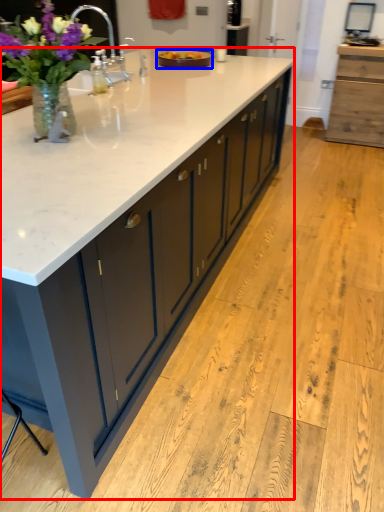
Question: Among these objects, which one is nearest to the camera, countertop (highlighted by a red box) or tray (highlighted by a blue box)?

Choices:
 (A) countertop
 (B) tray

Answer: (A)